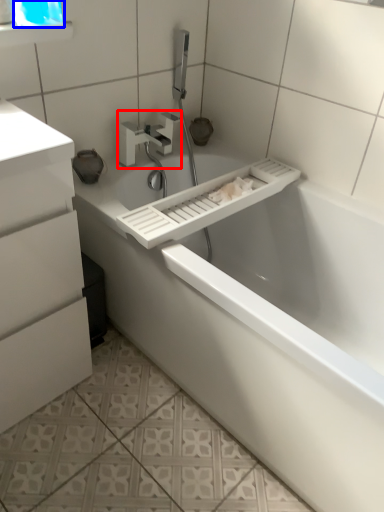
Question: Which object appears closest to the camera in this image, tap (highlighted by a red box) or window screen (highlighted by a blue box)?

Choices:
 (A) tap
 (B) window screen

Answer: (B)